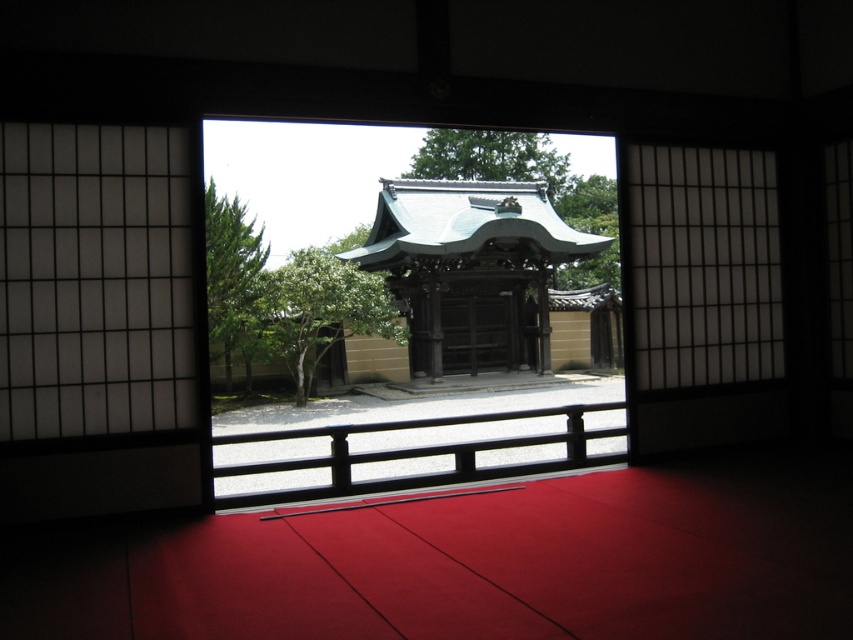
Is transparent glass window at center above wooden at center?

Indeed, transparent glass window at center is positioned over wooden at center.

In the scene shown: Between transparent glass window at center and wooden at center, which one appears on the right side from the viewer's perspective?

Positioned to the right is wooden at center.

Which is in front, point (511, 429) or point (480, 310)?

Positioned in front is point (511, 429).

You are a GUI agent. You are given a task and a screenshot of the screen. Output one action in this format:
    pyautogui.click(x=<x>, y=<y>)
    Task: Click on the transparent glass window at center
    The width and height of the screenshot is (853, 640).
    Given the screenshot: What is the action you would take?
    pyautogui.click(x=392, y=172)